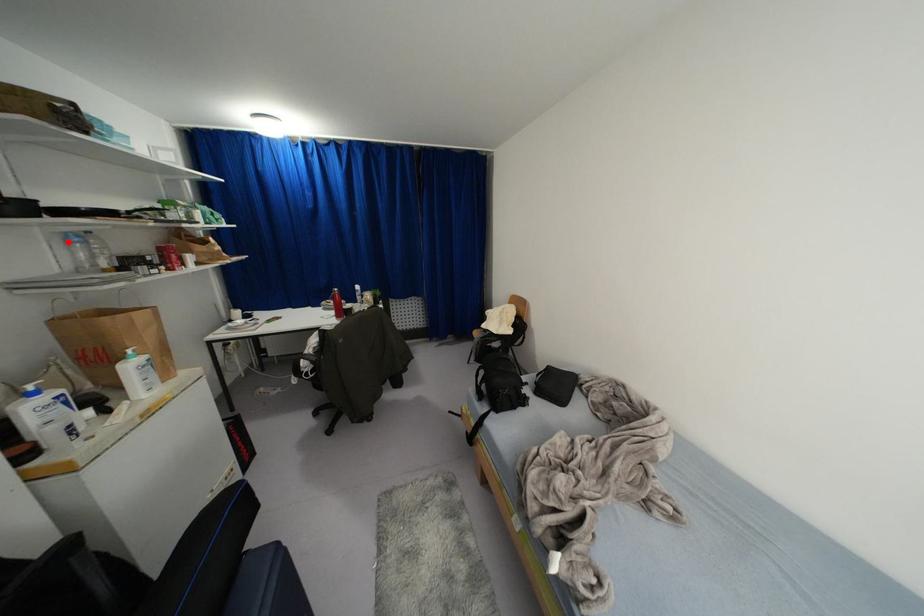
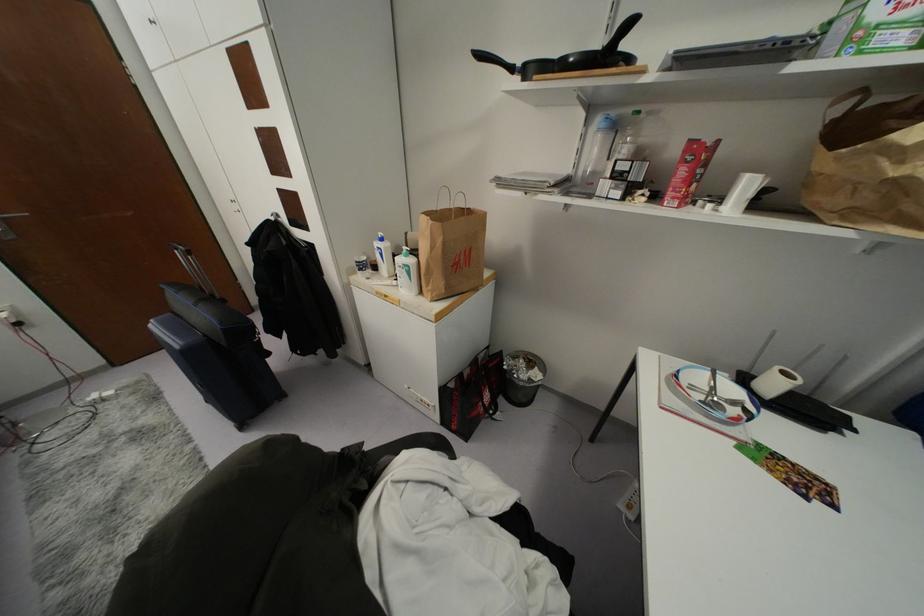
Locate, in the second image, the point that corresponds to the highlighted location in the first image.

(599, 130)